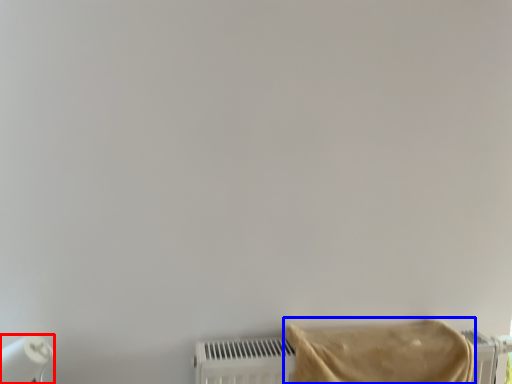
Question: Which point is further to the camera, paper towel (highlighted by a red box) or towel (highlighted by a blue box)?

Choices:
 (A) paper towel
 (B) towel

Answer: (A)